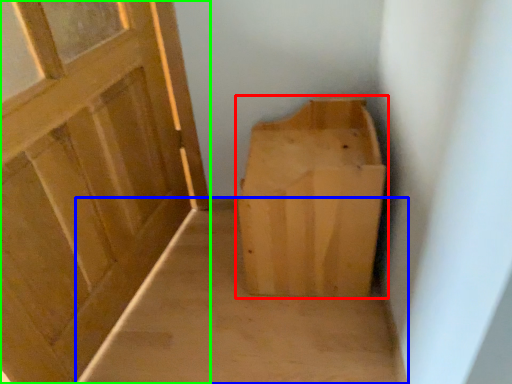
Question: Which object is the farthest from furniture (highlighted by a red box)? Choose among these: plain (highlighted by a blue box) or door (highlighted by a green box).

Choices:
 (A) plain
 (B) door

Answer: (B)